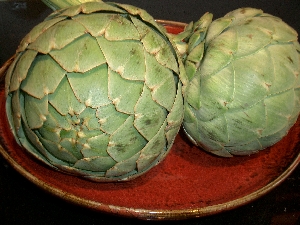
Identify the location of brown rim on plate. (153, 214).